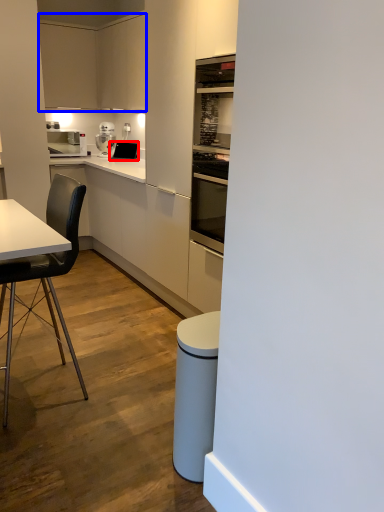
Question: Which point is closer to the camera, appliance (highlighted by a red box) or cabinetry (highlighted by a blue box)?

Choices:
 (A) appliance
 (B) cabinetry

Answer: (B)